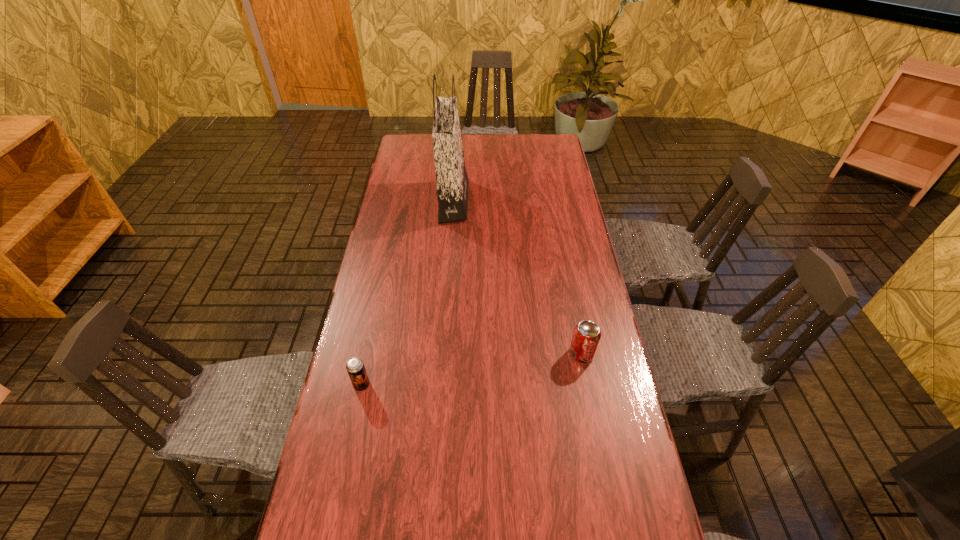
The image size is (960, 540). I want to click on the second object from right to left, so click(452, 181).

This screenshot has height=540, width=960. What are the coordinates of `shopping bag` in the screenshot? It's located at (452, 181).

Where is `soda can`? soda can is located at coordinates (586, 336).

This screenshot has height=540, width=960. Identify the location of the rightmost object. (586, 336).

You are a GUI agent. You are given a task and a screenshot of the screen. Output one action in this format:
    pyautogui.click(x=<x>, y=<y>)
    Task: Click on the beer can
    Image resolution: width=960 pixels, height=540 pixels.
    Given the screenshot: What is the action you would take?
    pyautogui.click(x=355, y=367)

Where is `the nearest object`? The image size is (960, 540). the nearest object is located at coordinates (355, 367).

At what (x,y) coordinates should I click in order to perform the action: click on vacant space located 0.330m on the front of the shopping bag with the design. Please return your answer as a coordinate pair (x, y). Looking at the image, I should click on (552, 201).

Identify the location of free spot located on the back of the soda can. Image resolution: width=960 pixels, height=540 pixels. (572, 303).

This screenshot has height=540, width=960. I want to click on vacant space located 0.170m on the front of the nearest object, so (x=347, y=457).

Locate an element on the screen. This screenshot has width=960, height=540. object that is at the left edge is located at coordinates (355, 367).